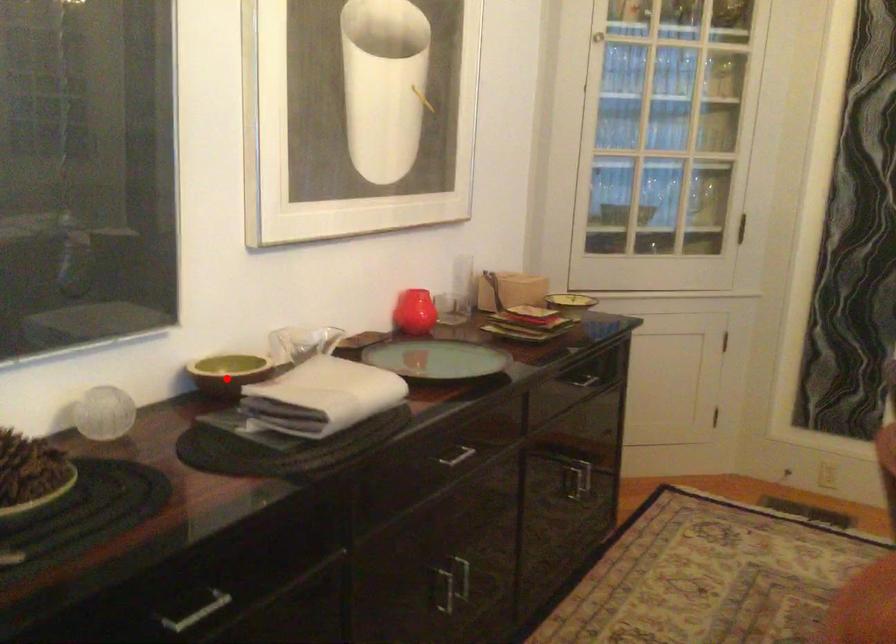
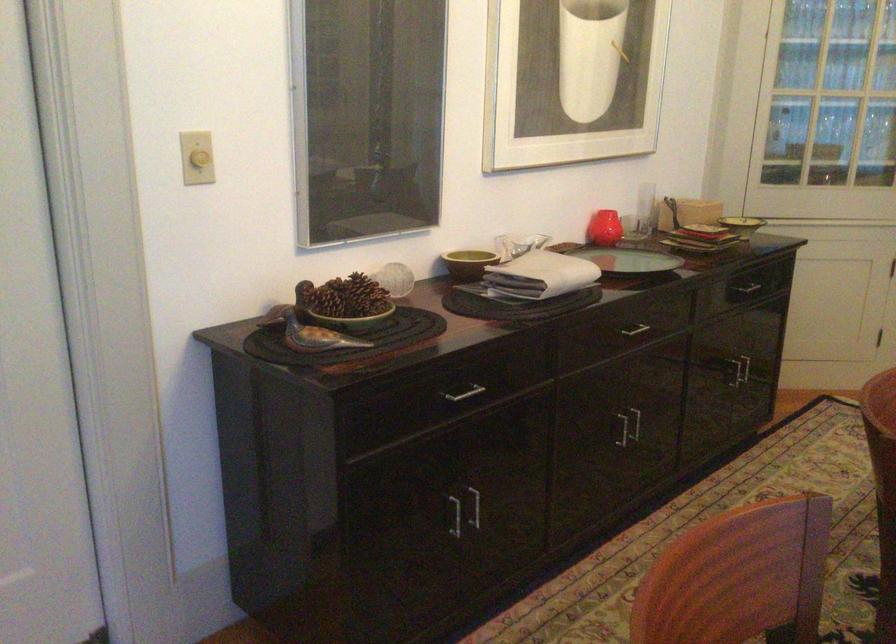
Question: A red point is marked in image1. In image2, is the corresponding 3D point closer to the camera or farther? Reply with the corresponding letter.

Choices:
 (A) The corresponding 3D point is closer.
 (B) The corresponding 3D point is farther.

Answer: (B)